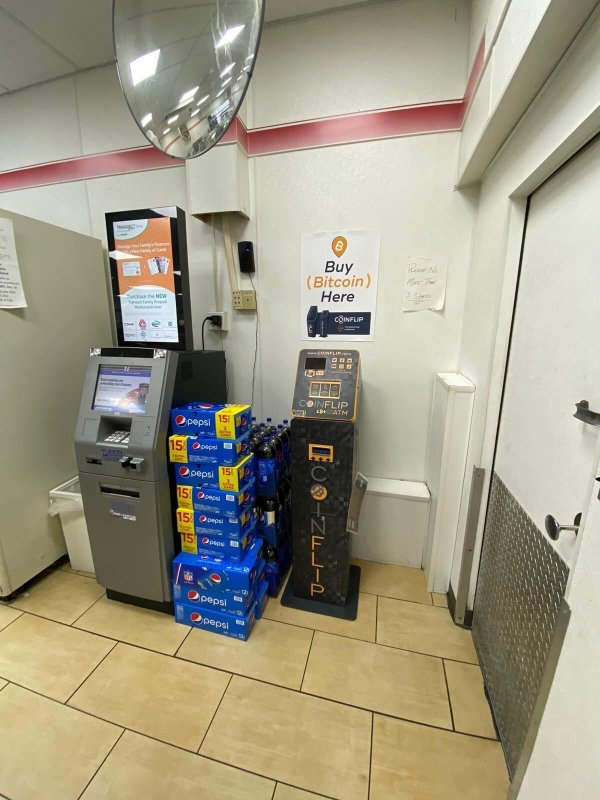
Where is `door`? This screenshot has height=800, width=600. door is located at coordinates (545, 462).